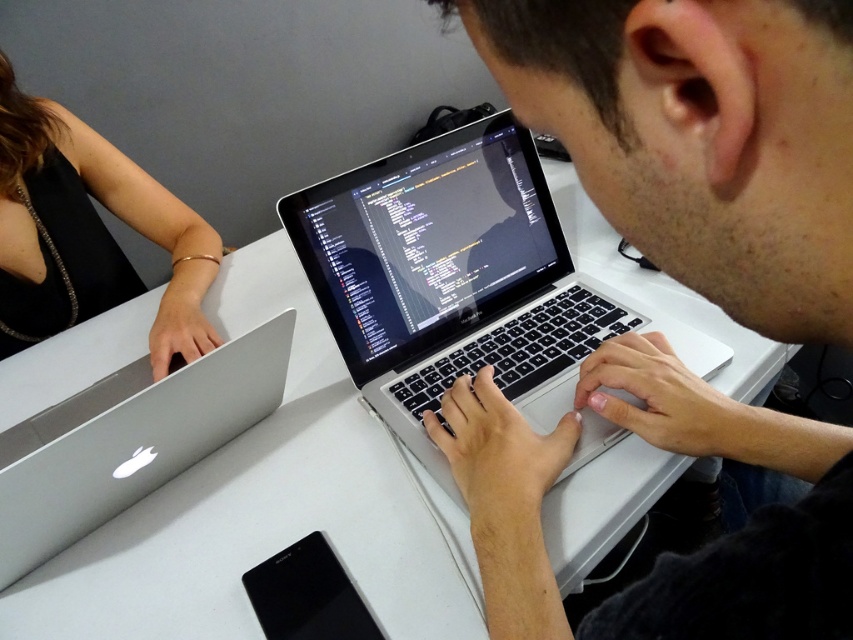
Question: Can you confirm if white glossy table at center is thinner than silver/black keyboard at center?

Choices:
 (A) yes
 (B) no

Answer: (B)

Question: Which object appears farthest from the camera in this image?

Choices:
 (A) black fabric arm at upper left
 (B) silver/black keyboard at center
 (C) matte black laptop at center
 (D) silver metallic laptop at left

Answer: (A)

Question: Does silver/black keyboard at center appear under silver metallic laptop at left?

Choices:
 (A) yes
 (B) no

Answer: (B)

Question: Among these points, which one is nearest to the camera?

Choices:
 (A) (128, 474)
 (B) (486, 362)
 (C) (178, 630)

Answer: (C)

Question: Where is white glossy table at center located in relation to silver metallic laptop at left in the image?

Choices:
 (A) above
 (B) below

Answer: (A)

Question: Which of the following is the farthest from the observer?

Choices:
 (A) (529, 266)
 (B) (463, 516)
 (C) (688, 172)

Answer: (A)